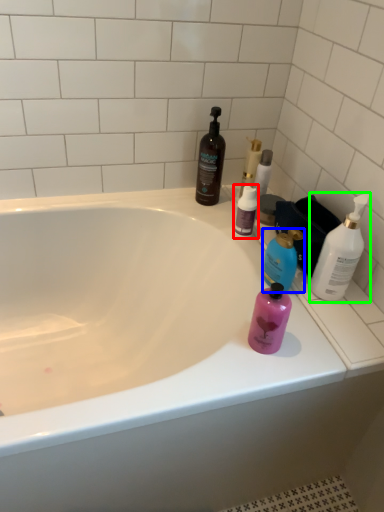
Question: Based on their relative distances, which object is farther from bottle (highlighted by a red box)? Choose from bottle (highlighted by a blue box) and bottle (highlighted by a green box).

Choices:
 (A) bottle
 (B) bottle

Answer: (B)